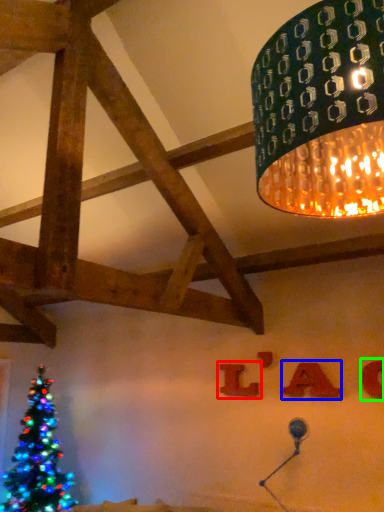
Question: Estimate the real-world distances between objects in this image. Which object is closer to alphabet (highlighted by a red box), alphabet (highlighted by a blue box) or alphabet (highlighted by a green box)?

Choices:
 (A) alphabet
 (B) alphabet

Answer: (A)